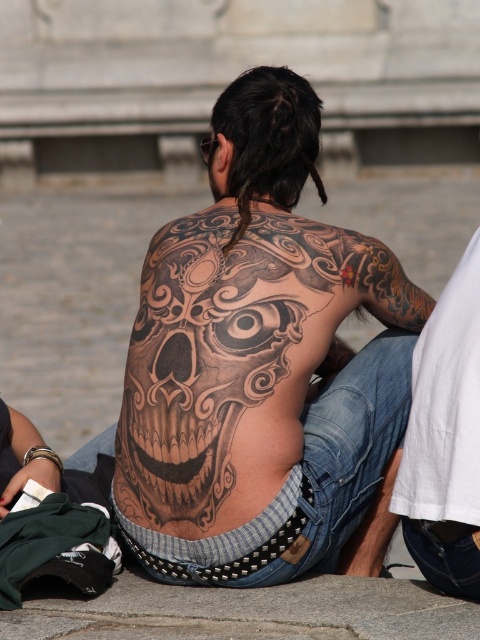
Question: Does black tattooed skull at center appear on the right side of black tattooed skin at right?

Choices:
 (A) no
 (B) yes

Answer: (A)

Question: Which object appears farthest from the camera in this image?

Choices:
 (A) black tattooed skin at right
 (B) black tattooed skull at center

Answer: (B)

Question: Which point appears closest to the camera in this image?

Choices:
 (A) (475, 436)
 (B) (322, 488)

Answer: (A)

Question: Is black tattooed skull at center below black tattooed skin at right?

Choices:
 (A) yes
 (B) no

Answer: (B)

Question: Does black tattooed skull at center have a smaller size compared to black tattooed skin at right?

Choices:
 (A) yes
 (B) no

Answer: (B)